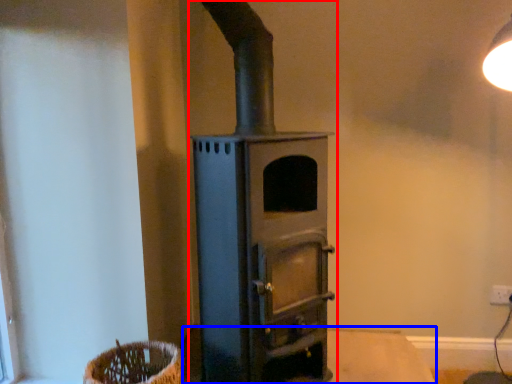
Question: Among these objects, which one is farthest to the camera, wood burning stove (highlighted by a red box) or table (highlighted by a blue box)?

Choices:
 (A) wood burning stove
 (B) table

Answer: (B)